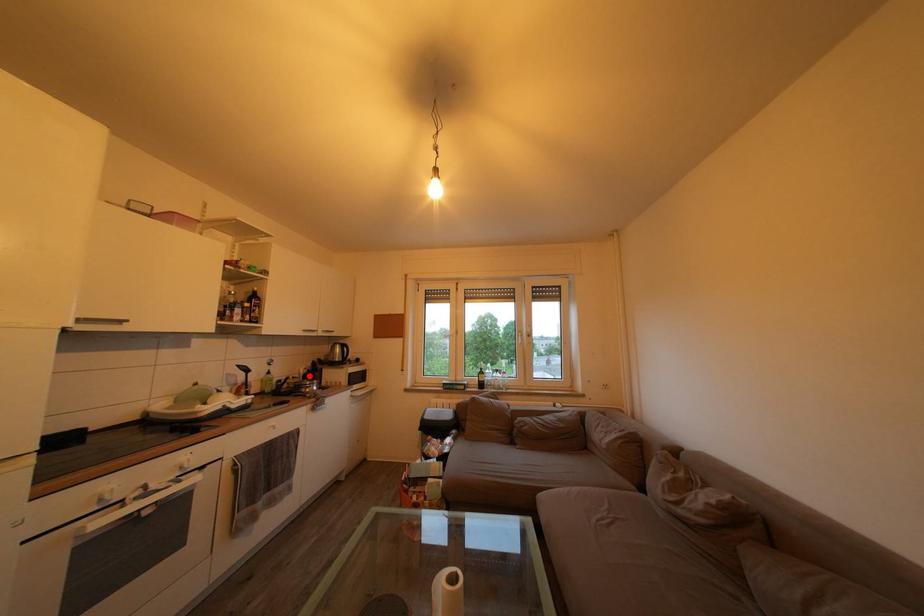
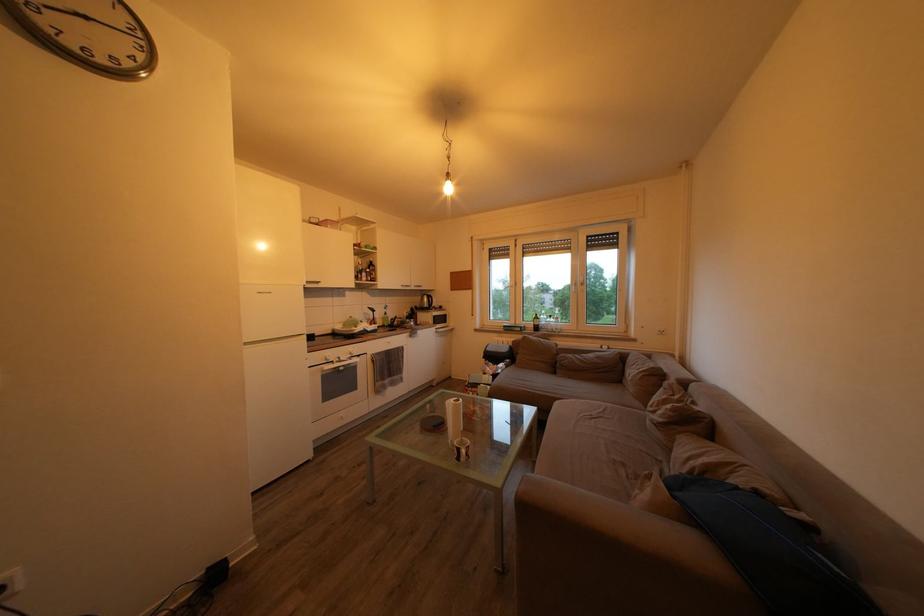
Question: I am providing you with two images of the same scene from different viewpoints. Image1 has a red point marked. In image2, the corresponding 3D location appears at what relative position? Reply with the corresponding letter.

Choices:
 (A) Closer
 (B) Farther

Answer: (A)